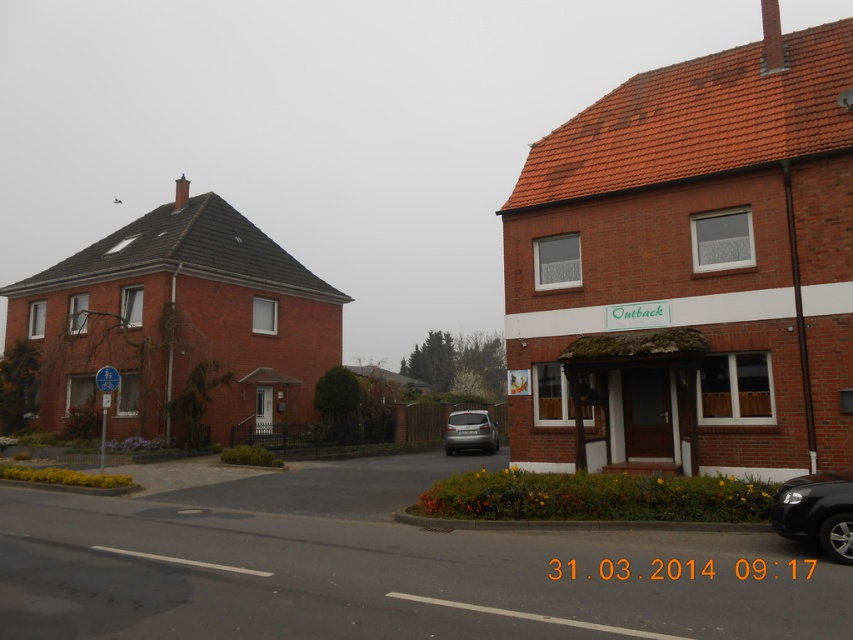
Does shiny black car at lower right appear over satin silver car at center?

Yes, shiny black car at lower right is above satin silver car at center.

Measure the distance between shiny black car at lower right and camera.

shiny black car at lower right and camera are 24.64 feet apart from each other.

Is point (811, 524) positioned behind point (486, 417)?

No.

Where is `shiny black car at lower right`? shiny black car at lower right is located at coordinates (816, 512).